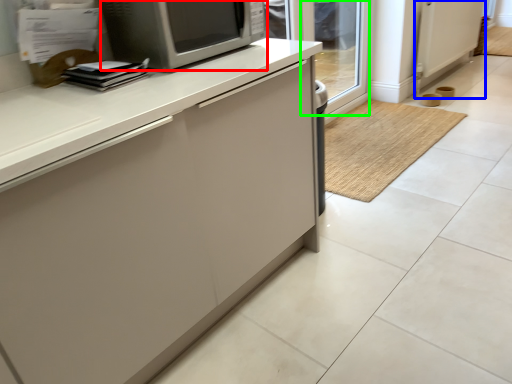
Question: Estimate the real-world distances between objects in this image. Which object is closer to microwave oven (highlighted by a red box), screen door (highlighted by a blue box) or glass door (highlighted by a green box)?

Choices:
 (A) screen door
 (B) glass door

Answer: (B)